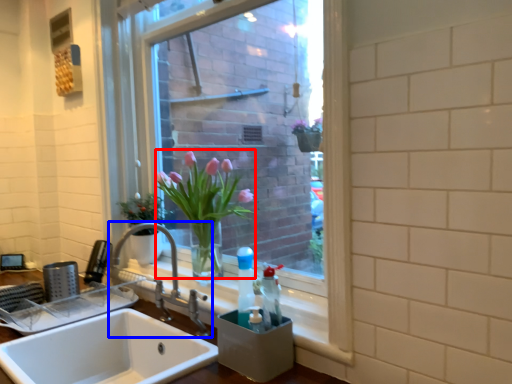
Question: Among these objects, which one is nearest to the camera, floral arrangement (highlighted by a red box) or tap (highlighted by a blue box)?

Choices:
 (A) floral arrangement
 (B) tap

Answer: (B)